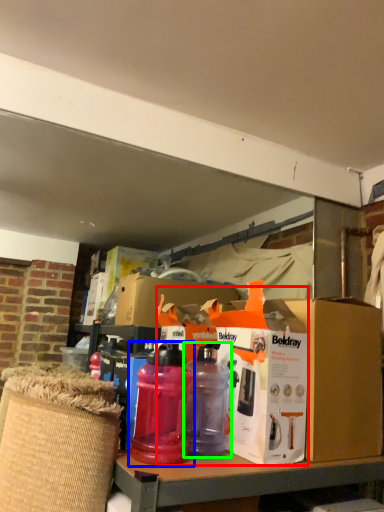
Question: Based on their relative distances, which object is farther from box (highlighted by a red box)? Choose from bottle (highlighted by a blue box) and bottle (highlighted by a green box).

Choices:
 (A) bottle
 (B) bottle

Answer: (A)